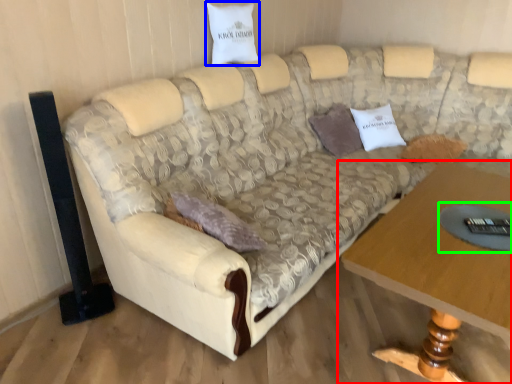
Question: Which is nearer to the table (highlighted by a red box)? pillow (highlighted by a blue box) or glass table (highlighted by a green box).

Choices:
 (A) pillow
 (B) glass table

Answer: (B)